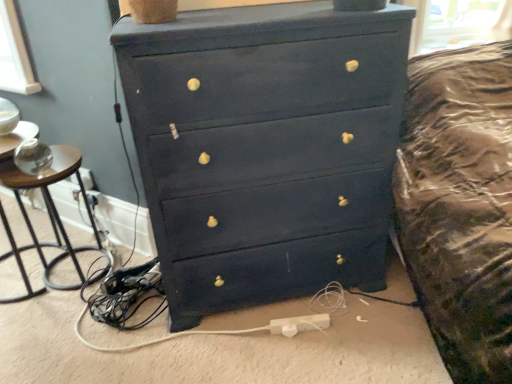
Question: Is matte black dresser at center positioned beyond the bounds of brown wood side table at left?

Choices:
 (A) no
 (B) yes

Answer: (B)

Question: Does matte black dresser at center have a larger size compared to brown wood side table at left?

Choices:
 (A) no
 (B) yes

Answer: (B)

Question: Is the depth of matte black dresser at center greater than that of brown wood side table at left?

Choices:
 (A) yes
 (B) no

Answer: (B)

Question: Is matte black dresser at center at the right side of brown wood side table at left?

Choices:
 (A) no
 (B) yes

Answer: (B)

Question: Considering the relative sizes of matte black dresser at center and brown wood side table at left in the image provided, is matte black dresser at center thinner than brown wood side table at left?

Choices:
 (A) yes
 (B) no

Answer: (B)

Question: Considering the relative positions of white plastic extension cord at lower center and matte black dresser at center in the image provided, is white plastic extension cord at lower center to the left or to the right of matte black dresser at center?

Choices:
 (A) right
 (B) left

Answer: (A)

Question: Is white plastic extension cord at lower center in front of or behind matte black dresser at center in the image?

Choices:
 (A) behind
 (B) front

Answer: (A)

Question: In terms of height, does white plastic extension cord at lower center look taller or shorter compared to matte black dresser at center?

Choices:
 (A) short
 (B) tall

Answer: (A)

Question: Is point (306, 322) positioned closer to the camera than point (369, 228)?

Choices:
 (A) farther
 (B) closer

Answer: (A)

Question: Choose the correct answer: Is brown wood side table at left inside matte black dresser at center or outside it?

Choices:
 (A) inside
 (B) outside

Answer: (B)

Question: From their relative heights in the image, would you say brown wood side table at left is taller or shorter than matte black dresser at center?

Choices:
 (A) tall
 (B) short

Answer: (B)

Question: From a real-world perspective, is brown wood side table at left physically located above or below matte black dresser at center?

Choices:
 (A) above
 (B) below

Answer: (B)

Question: Considering their positions, is brown wood side table at left located in front of or behind matte black dresser at center?

Choices:
 (A) behind
 (B) front

Answer: (A)

Question: From the image's perspective, is brown wood side table at left above or below white plastic extension cord at lower center?

Choices:
 (A) above
 (B) below

Answer: (A)

Question: Based on their positions, is brown wood side table at left located to the left or right of white plastic extension cord at lower center?

Choices:
 (A) left
 (B) right

Answer: (A)